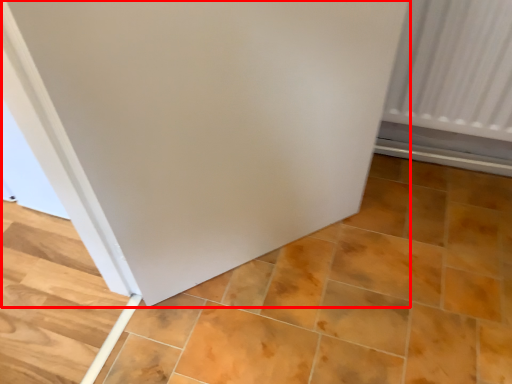
Question: From the image's perspective, where is door (annotated by the red box) located relative to ceramic tile?

Choices:
 (A) above
 (B) below

Answer: (A)